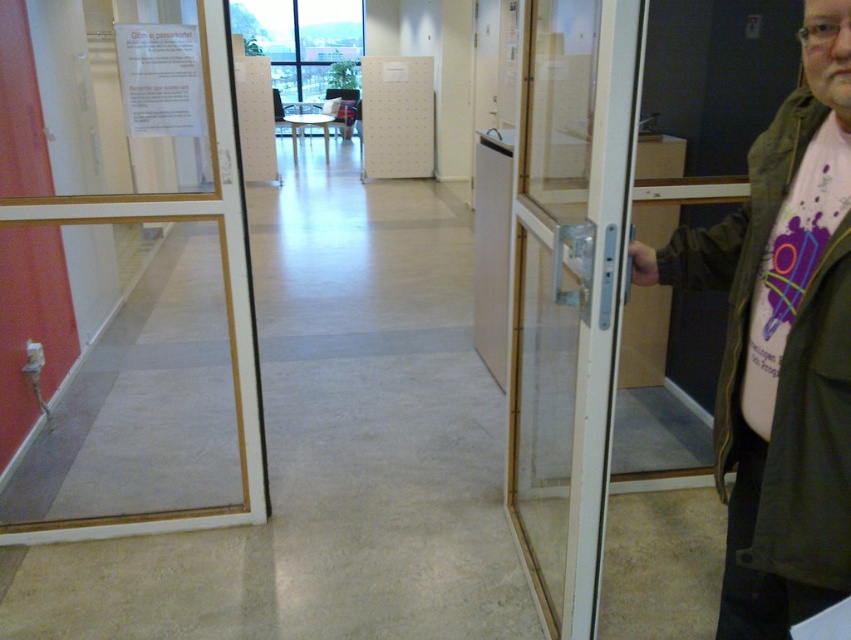
Consider the image. You are standing in the hallway and want to enter the waiting area. Is the transparent glass door at right the correct entrance?

The transparent glass door at right is the correct entrance as it is the only door visible in the hallway leading into the waiting area.

You are standing in the hallway and want to find the passport office. There is a point marked at coordinates (568, 291) on the transparent glass door at right. What does this point indicate?

The point at coordinates (568, 291) on the transparent glass door at right marks the location of the notice with the text in English and another language, specifically the Swedish phrase

You are a delivery person entering the hallway and need to choose between the transparent glass door at right and the clear glass door at left. Which door is taller?

The transparent glass door at right is taller than the clear glass door at left according to the description.